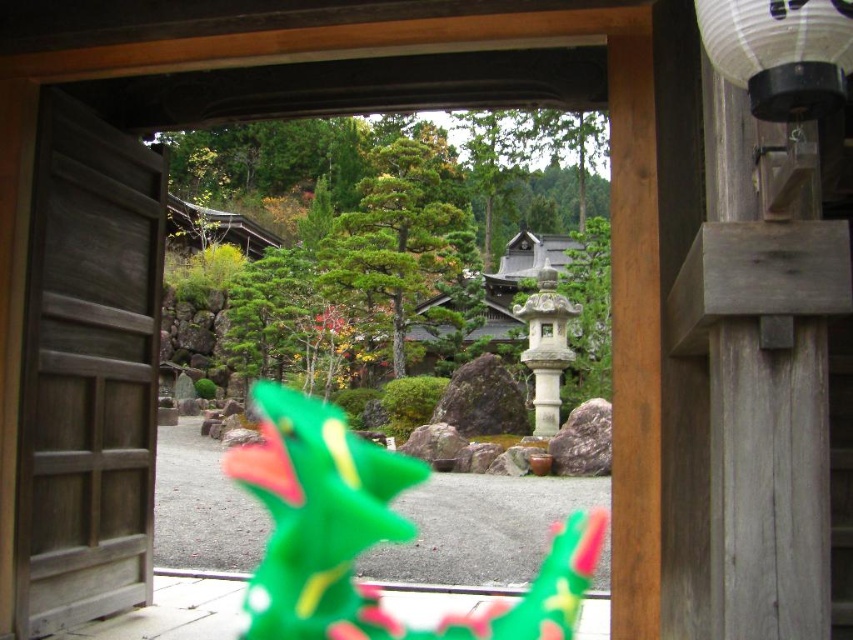
You are standing in a garden and want to take a closer look at the green plastic dragon at center. If you walk 10 feet forward, will you be able to touch it?

The green plastic dragon at center is 16.96 feet away from you. After walking 10 feet forward, you will still be 6.96 feet away from it, so you cannot touch it yet.

You are planning to hang a new decoration that requires a support structure wider than the wooden door at left. Based on the scene, can the white paper lantern at upper right provide sufficient width for this requirement?

The wooden door at left might be wider than the white paper lantern at upper right, so it is uncertain if the white paper lantern at upper right can provide sufficient width for the decoration. Check the actual dimensions before deciding.